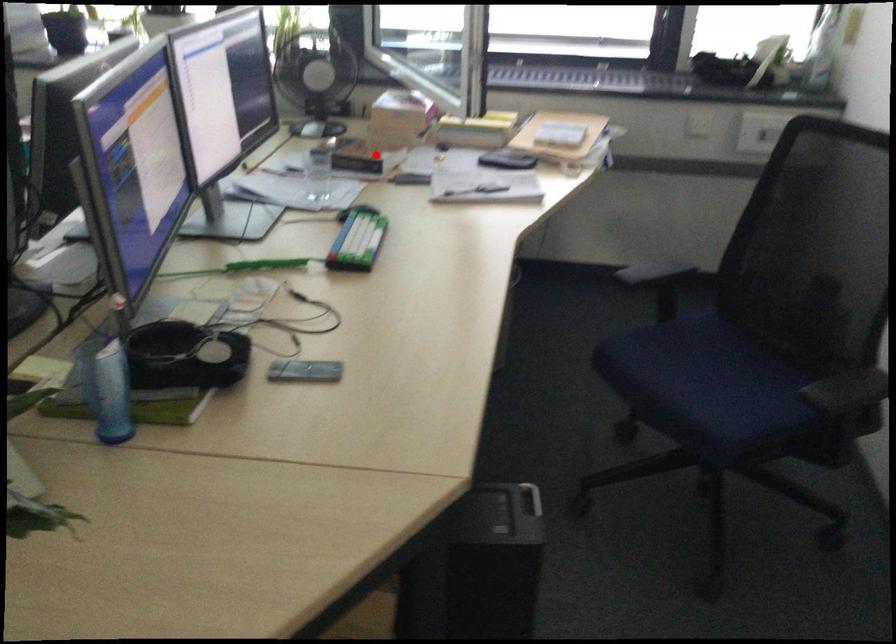
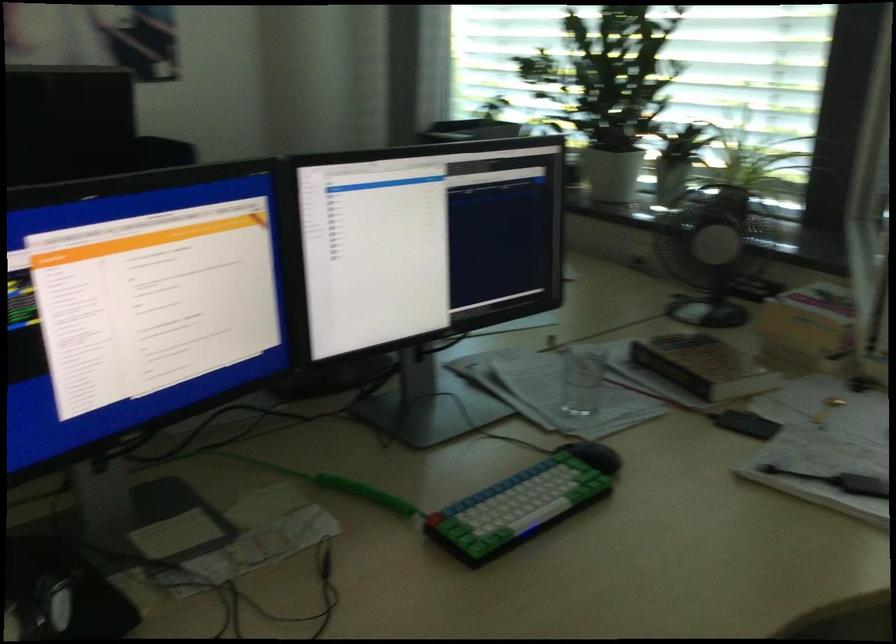
Question: I am providing you with two images of the same scene from different viewpoints. A red point is marked on the first image. At the location where the point appears in image 1, is it still visible in image 2?

Choices:
 (A) Yes
 (B) No

Answer: (A)